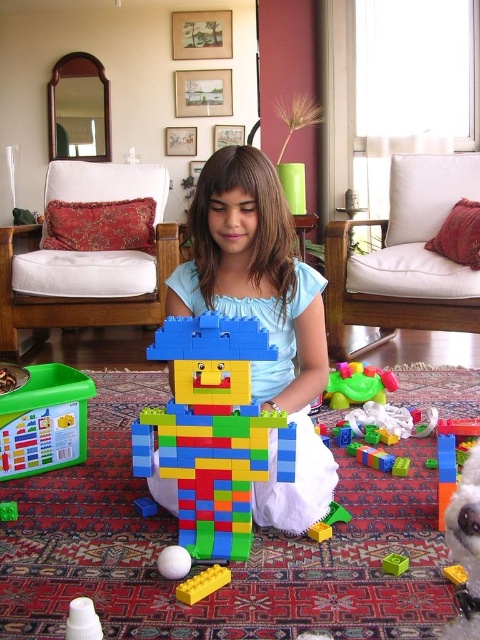
Question: Does multicolored plastic blocks at center appear under green plastic cube at center?

Choices:
 (A) no
 (B) yes

Answer: (A)

Question: Which point is farther from the camera taking this photo?

Choices:
 (A) (328, 536)
 (B) (187, 378)
 (C) (210, 589)
 (D) (151, 502)

Answer: (D)

Question: Does translucent green plastic container at lower left appear on the right side of white plastic cup at lower left?

Choices:
 (A) yes
 (B) no

Answer: (B)

Question: Does green plastic cube at center have a smaller size compared to bright yellow plastic block at center?

Choices:
 (A) no
 (B) yes

Answer: (A)

Question: Which of the following is the farthest from the observer?

Choices:
 (A) white fluffy dog at lower right
 (B) multicolored plastic toy at center
 (C) smooth plastic toy at center

Answer: (C)

Question: Which of the following is the farthest from the observer?

Choices:
 (A) (398, 566)
 (B) (310, 326)
 (C) (459, 616)
 (D) (149, 506)

Answer: (B)